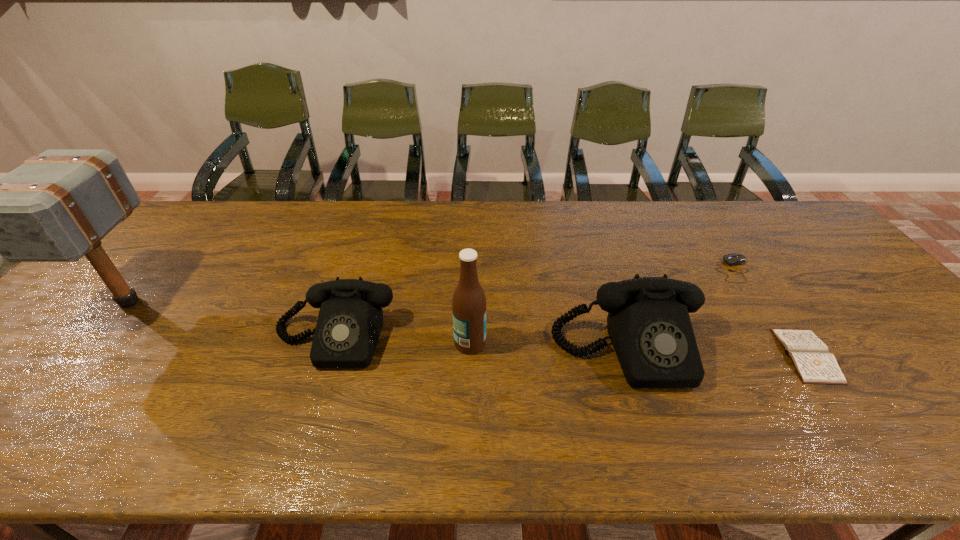
Identify the location of vacant space in between the tallest object and the second object from left to right. pos(231,320).

Where is `free space between the mallet and the fifth tallest object`? free space between the mallet and the fifth tallest object is located at coordinates (432, 286).

The image size is (960, 540). What are the coordinates of `vacant space that is in between the computer mouse and the diary` in the screenshot? It's located at (770, 313).

Where is `free space between the leftmost object and the beer bottle`? free space between the leftmost object and the beer bottle is located at coordinates (300, 322).

Where is `empty space between the diary and the computer mouse`? The height and width of the screenshot is (540, 960). empty space between the diary and the computer mouse is located at coordinates (770, 313).

Identify the location of vacant point located between the fourth object from left to right and the fourth object from right to left. The height and width of the screenshot is (540, 960). (549, 347).

You are a GUI agent. You are given a task and a screenshot of the screen. Output one action in this format:
    pyautogui.click(x=<x>, y=<y>)
    Task: Click on the object that stands as the fifth closest to the diary
    This screenshot has width=960, height=540.
    Given the screenshot: What is the action you would take?
    pyautogui.click(x=56, y=207)

Where is `object that is the third nearest to the shortest object`? This screenshot has width=960, height=540. object that is the third nearest to the shortest object is located at coordinates (469, 301).

Identify the location of vacant space that satisfies the following two spatial constraints: 1. on the dial of the second object from left to right; 2. on the right side of the shortest object. The width and height of the screenshot is (960, 540). (328, 355).

I want to click on free spot that satisfies the following two spatial constraints: 1. on the striking surface of the tallest object; 2. on the left side of the fifth shortest object, so click(x=95, y=343).